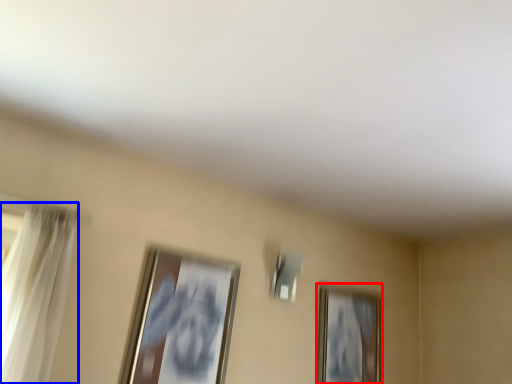
Question: Which object appears closest to the camera in this image, picture frame (highlighted by a red box) or curtain (highlighted by a blue box)?

Choices:
 (A) picture frame
 (B) curtain

Answer: (B)